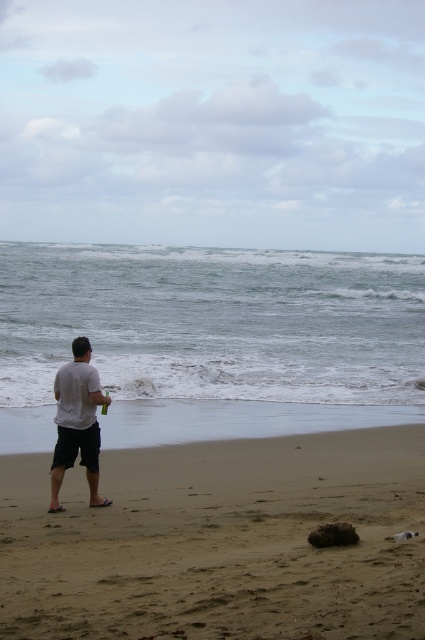
You are standing on the beach and see the sandy at left and the white matte shirt at center. Which object is smaller in size?

The sandy at left is smaller than the white matte shirt at center.

You are standing on the beach and see the sandy at left and the white matte shirt at center. Which object is closer to the ocean?

The sandy at left is closer to the ocean because it is positioned to the right of the white matte shirt at center, which is further inland.